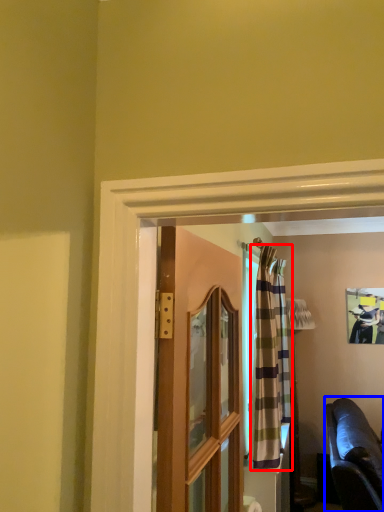
Question: Which point is closer to the camera, curtain (highlighted by a red box) or studio couch (highlighted by a blue box)?

Choices:
 (A) curtain
 (B) studio couch

Answer: (B)